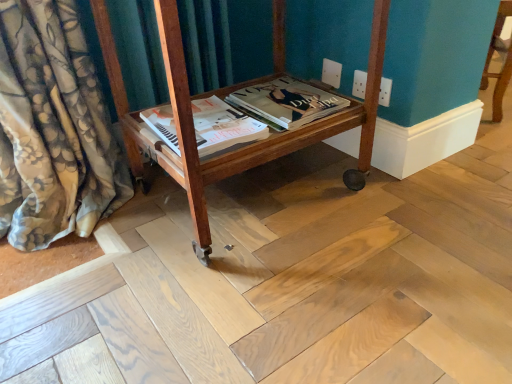
Question: Considering the relative sizes of matte paper magazine at center, the 2th magazine positioned from the right, and matte paper magazine at center, the second magazine in the left-to-right sequence, in the image provided, is matte paper magazine at center, the 2th magazine positioned from the right, shorter than matte paper magazine at center, the second magazine in the left-to-right sequence,?

Choices:
 (A) yes
 (B) no

Answer: (A)

Question: Can you confirm if matte paper magazine at center, the 2th magazine positioned from the right, is wider than matte paper magazine at center, the second magazine in the left-to-right sequence?

Choices:
 (A) no
 (B) yes

Answer: (B)

Question: Would you say matte paper magazine at center, the second magazine in the left-to-right sequence, is part of matte paper magazine at center, the 2th magazine positioned from the right,'s contents?

Choices:
 (A) no
 (B) yes

Answer: (A)

Question: Considering the relative positions of matte paper magazine at center, which is the 1th magazine from left to right, and matte paper magazine at center, which appears as the 1th magazine when viewed from the right, in the image provided, is matte paper magazine at center, which is the 1th magazine from left to right, to the left of matte paper magazine at center, which appears as the 1th magazine when viewed from the right, from the viewer's perspective?

Choices:
 (A) no
 (B) yes

Answer: (B)

Question: Is matte paper magazine at center, which is the 1th magazine from left to right, turned away from matte paper magazine at center, which appears as the 1th magazine when viewed from the right?

Choices:
 (A) yes
 (B) no

Answer: (B)

Question: Can you confirm if matte paper magazine at center, the 2th magazine positioned from the right, is smaller than matte paper magazine at center, the second magazine in the left-to-right sequence?

Choices:
 (A) yes
 (B) no

Answer: (A)

Question: Would you consider wooden cart at center to be distant from matte paper magazine at center, which is the 1th magazine from left to right?

Choices:
 (A) yes
 (B) no

Answer: (B)

Question: Can you confirm if wooden cart at center is smaller than matte paper magazine at center, the 2th magazine positioned from the right?

Choices:
 (A) no
 (B) yes

Answer: (A)

Question: Is wooden cart at center turned away from matte paper magazine at center, which is the 1th magazine from left to right?

Choices:
 (A) yes
 (B) no

Answer: (A)

Question: Can you confirm if wooden cart at center is thinner than matte paper magazine at center, which is the 1th magazine from left to right?

Choices:
 (A) no
 (B) yes

Answer: (A)

Question: Considering the relative positions of wooden cart at center and matte paper magazine at center, which is the 1th magazine from left to right, in the image provided, is wooden cart at center to the right of matte paper magazine at center, which is the 1th magazine from left to right, from the viewer's perspective?

Choices:
 (A) yes
 (B) no

Answer: (A)

Question: Can you confirm if wooden cart at center is shorter than matte paper magazine at center, the 2th magazine positioned from the right?

Choices:
 (A) yes
 (B) no

Answer: (B)

Question: Is matte paper magazine at center, the second magazine in the left-to-right sequence, outside wooden cart at center?

Choices:
 (A) no
 (B) yes

Answer: (A)